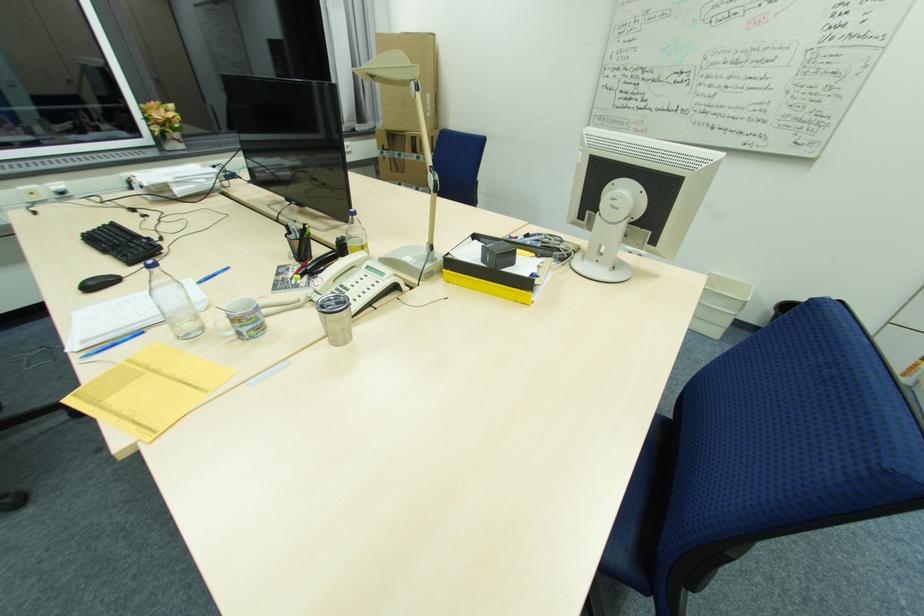
Where would you lift the white mug handle? Please return your answer as a coordinate pair (x, y).

(334, 318)